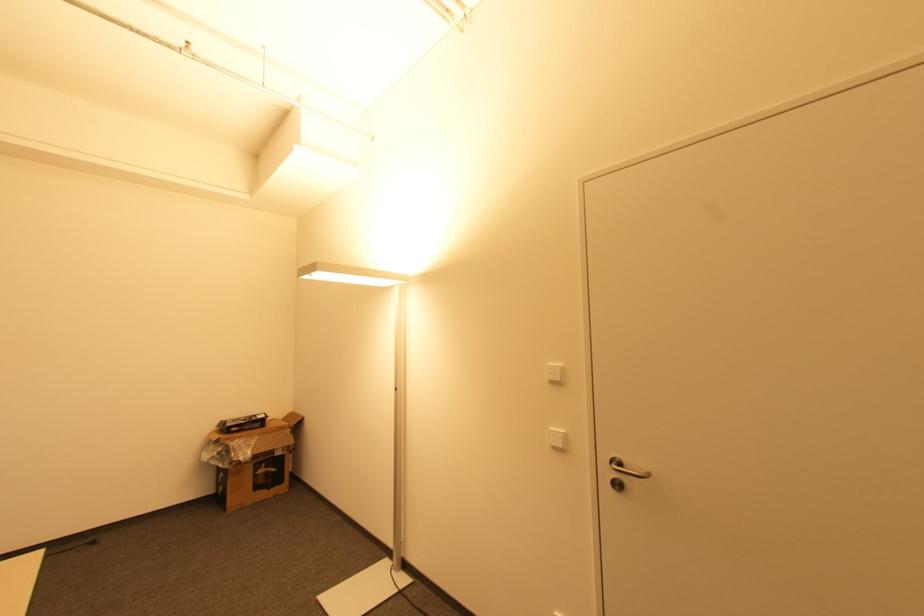
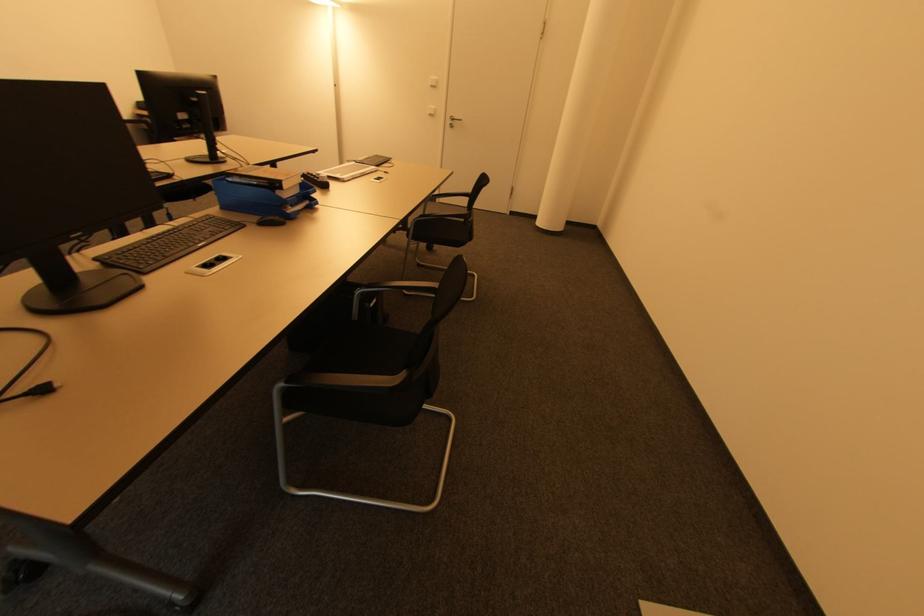
Locate, in the second image, the point that corresponds to [621,487] in the first image.

(454, 127)